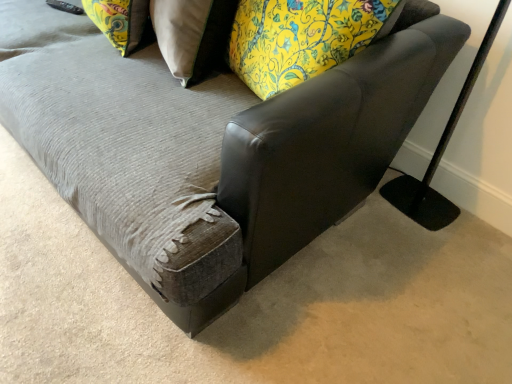
Identify the location of blank area to the left of black matte table lamp at right. The width and height of the screenshot is (512, 384). (370, 216).